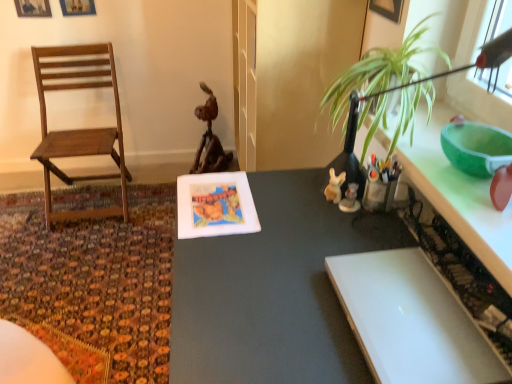
This screenshot has width=512, height=384. Find the location of `free space to the left of white matte rabbit at center-right, which is the first toy from left to right`. free space to the left of white matte rabbit at center-right, which is the first toy from left to right is located at coordinates (278, 203).